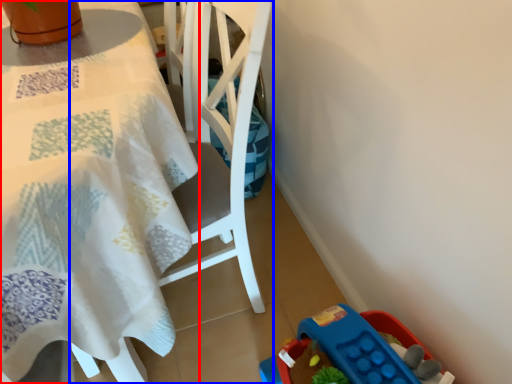
Question: Which of the following is the farthest to the observer, table (highlighted by a red box) or chair (highlighted by a blue box)?

Choices:
 (A) table
 (B) chair

Answer: (B)